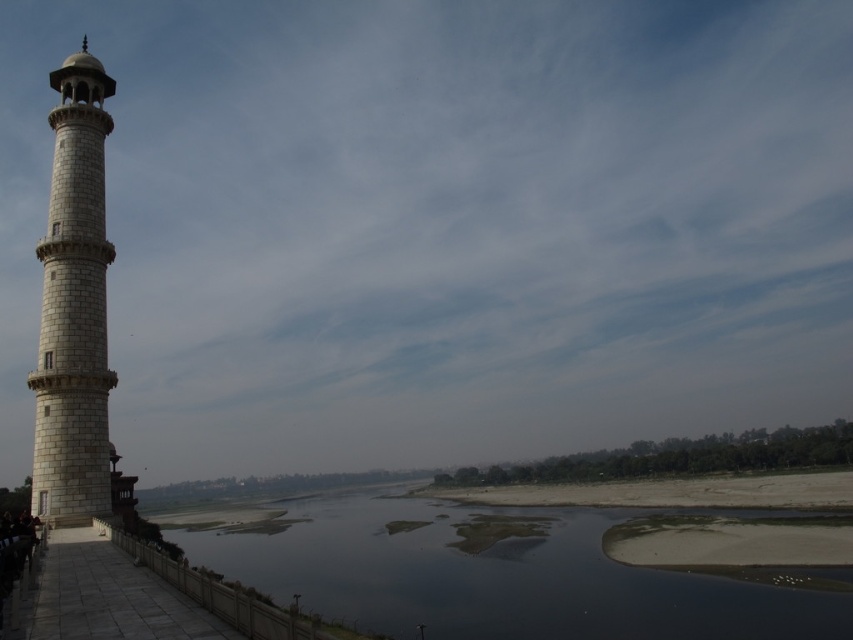
Question: Is dark water at lower center bigger than white stone tower at left?

Choices:
 (A) yes
 (B) no

Answer: (A)

Question: Which point is closer to the camera?

Choices:
 (A) white stone tower at left
 (B) dark water at lower center

Answer: (A)

Question: Does dark water at lower center appear over white stone tower at left?

Choices:
 (A) no
 (B) yes

Answer: (A)

Question: Is dark water at lower center in front of white stone tower at left?

Choices:
 (A) no
 (B) yes

Answer: (A)

Question: Which point is closer to the camera taking this photo?

Choices:
 (A) (73, 401)
 (B) (587, 602)

Answer: (A)

Question: Among these points, which one is nearest to the camera?

Choices:
 (A) (532, 516)
 (B) (59, 278)

Answer: (B)